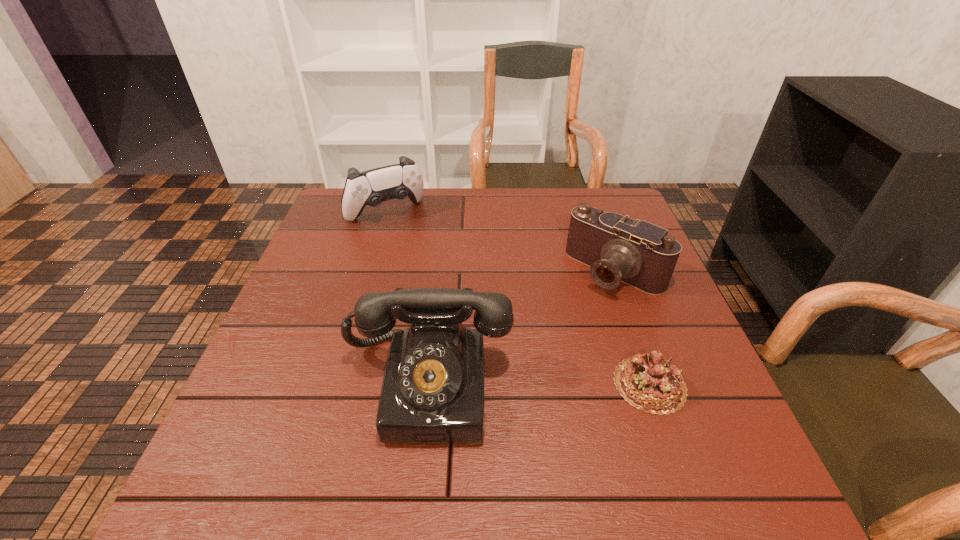
You are a GUI agent. You are given a task and a screenshot of the screen. Output one action in this format:
    pyautogui.click(x=<x>, y=<y>)
    Task: Click on the free space on the desktop that is between the tallest object and the shortest object and is positioned on the front-facing side of the third nearest object
    The width and height of the screenshot is (960, 540).
    Given the screenshot: What is the action you would take?
    click(x=506, y=384)

Where is `vacant space on the desktop that is between the tallest object and the chocolate cake and is positioned on the front-facing side of the control`? vacant space on the desktop that is between the tallest object and the chocolate cake and is positioned on the front-facing side of the control is located at coordinates (511, 384).